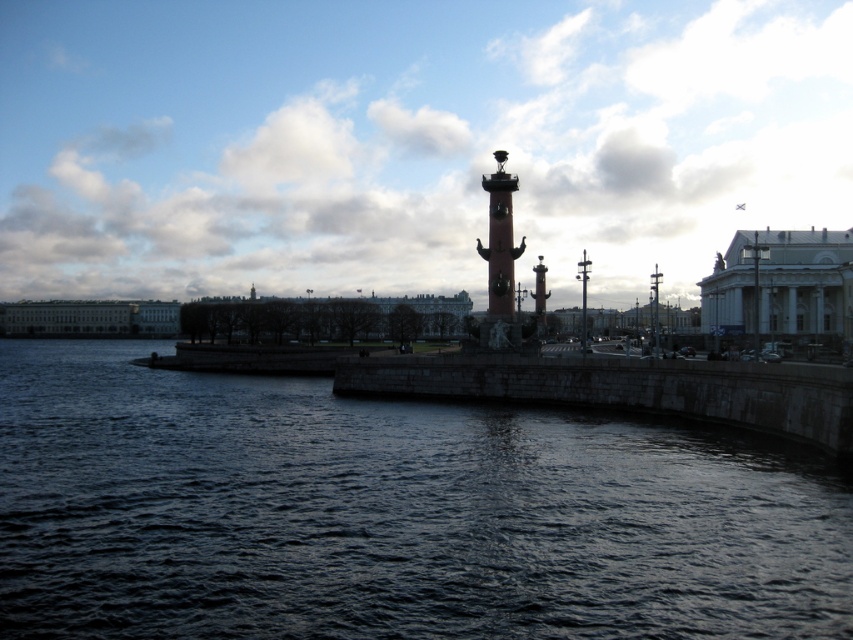
You are standing at the edge of the waterfront and want to locate the dark stone water at center. According to the coordinate system where the bottom left corner is the origin, can you tell me its position?

The dark stone water at center is located at coordinates point (392, 513).

In the scene shown: You are standing at the waterfront and want to determine the relative positions of two points marked in the scene. Which point is closer to you, point (x=425, y=557) or point (x=491, y=192)?

Point (x=425, y=557) is closer to the viewer than point (x=491, y=192).